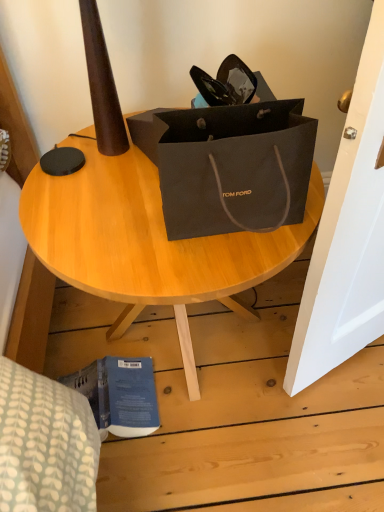
Question: Is blue matte book at lower left facing away from matte black bag at upper center?

Choices:
 (A) yes
 (B) no

Answer: (A)

Question: Does blue matte book at lower left touch matte black bag at upper center?

Choices:
 (A) no
 (B) yes

Answer: (A)

Question: Is blue matte book at lower left completely or partially outside of matte black bag at upper center?

Choices:
 (A) yes
 (B) no

Answer: (B)

Question: From the image's perspective, is blue matte book at lower left below matte black bag at upper center?

Choices:
 (A) yes
 (B) no

Answer: (A)

Question: Does blue matte book at lower left appear on the right side of matte black bag at upper center?

Choices:
 (A) yes
 (B) no

Answer: (B)

Question: Can you confirm if blue matte book at lower left is bigger than matte black bag at upper center?

Choices:
 (A) yes
 (B) no

Answer: (B)

Question: Is matte black bag at upper center touching blue matte book at lower left?

Choices:
 (A) yes
 (B) no

Answer: (B)

Question: Can you confirm if matte black bag at upper center is wider than blue matte book at lower left?

Choices:
 (A) yes
 (B) no

Answer: (A)

Question: From a real-world perspective, is matte black bag at upper center positioned over blue matte book at lower left based on gravity?

Choices:
 (A) yes
 (B) no

Answer: (A)

Question: Is blue matte book at lower left surrounded by matte black bag at upper center?

Choices:
 (A) yes
 (B) no

Answer: (A)

Question: From the image's perspective, is matte black bag at upper center above blue matte book at lower left?

Choices:
 (A) no
 (B) yes

Answer: (B)

Question: Is matte black bag at upper center at the right side of blue matte book at lower left?

Choices:
 (A) yes
 (B) no

Answer: (A)

Question: Would you say blue matte book at lower left is inside or outside matte black bag at upper center?

Choices:
 (A) inside
 (B) outside

Answer: (A)